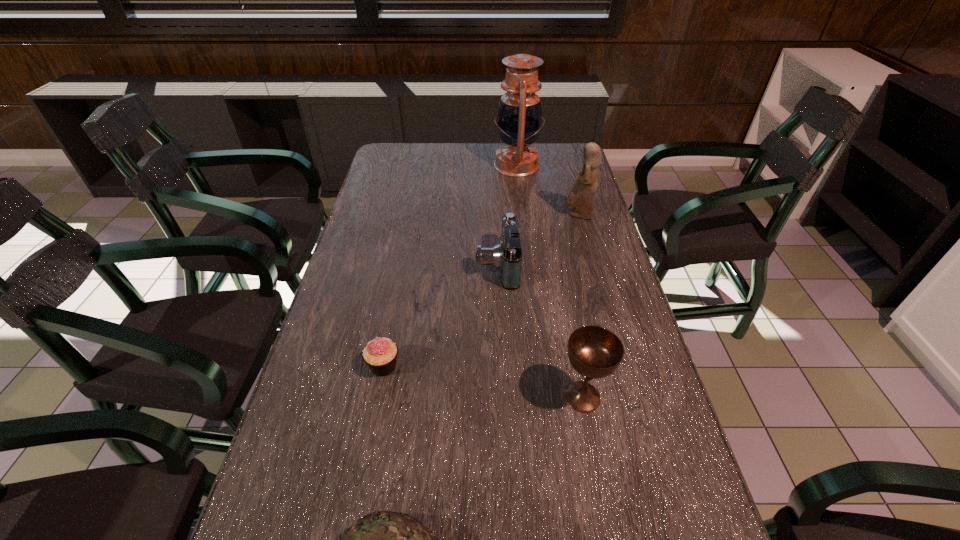
Where is `vacant space located 0.240m on the front-facing side of the figurine`? The height and width of the screenshot is (540, 960). vacant space located 0.240m on the front-facing side of the figurine is located at coordinates (491, 215).

You are a GUI agent. You are given a task and a screenshot of the screen. Output one action in this format:
    pyautogui.click(x=<x>, y=<y>)
    Task: Click on the blank area located 0.380m on the front-facing side of the figurine
    The image size is (960, 540).
    Given the screenshot: What is the action you would take?
    pyautogui.click(x=447, y=215)

In order to click on vacant point located on the back of the chalice in this screenshot , I will do `click(561, 284)`.

Identify the location of free space located 0.220m on the front-facing side of the third farthest object. (398, 265).

At what (x,y) coordinates should I click in order to perform the action: click on free location located on the front-facing side of the third farthest object. Please return your answer as a coordinate pair (x, y). Looking at the image, I should click on (371, 265).

Identify the location of vacant space situated on the front-facing side of the third farthest object. (413, 265).

The image size is (960, 540). I want to click on free space located 0.260m on the front of the cupcake, so click(x=357, y=505).

Where is `object that is at the far edge`? This screenshot has height=540, width=960. object that is at the far edge is located at coordinates (519, 119).

Where is `object present at the left edge`? This screenshot has height=540, width=960. object present at the left edge is located at coordinates (380, 354).

Image resolution: width=960 pixels, height=540 pixels. Identify the location of figurine located in the right edge section of the desktop. (582, 195).